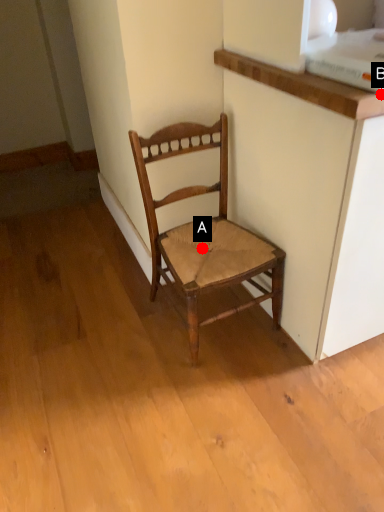
Question: Two points are circled on the image, labeled by A and B beside each circle. Which point is farther to the camera?

Choices:
 (A) A is further
 (B) B is further

Answer: (A)